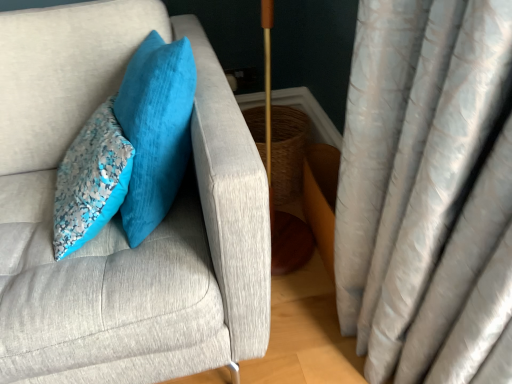
Where is `velvet gray couch at upper left`? This screenshot has height=384, width=512. velvet gray couch at upper left is located at coordinates (118, 223).

Image resolution: width=512 pixels, height=384 pixels. What do you see at coordinates (118, 223) in the screenshot?
I see `velvet gray couch at upper left` at bounding box center [118, 223].

This screenshot has width=512, height=384. I want to click on velvet gray couch at upper left, so click(118, 223).